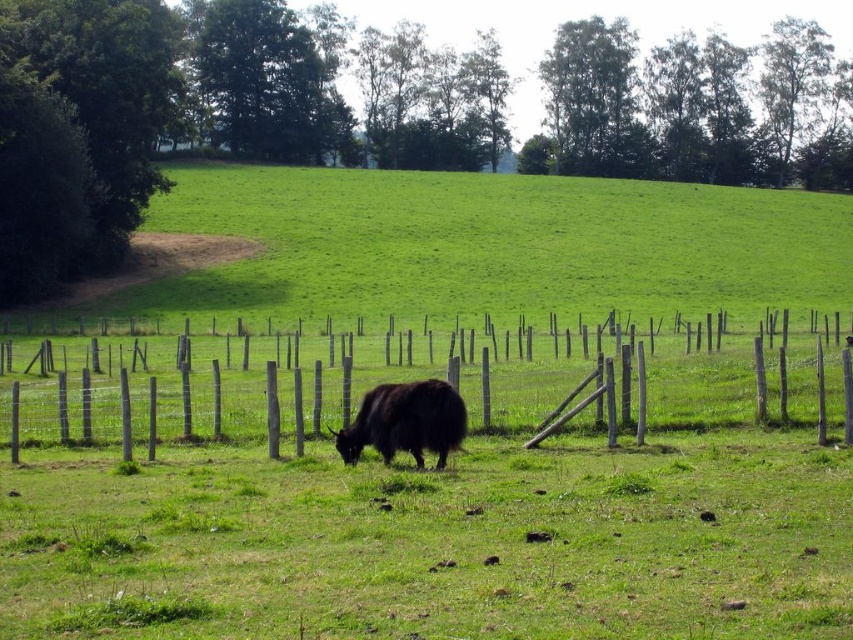
I want to click on wooden post fence at center, so click(x=448, y=381).

What do you see at coordinates (448, 381) in the screenshot? I see `wooden post fence at center` at bounding box center [448, 381].

Describe the element at coordinates (448, 381) in the screenshot. I see `wooden post fence at center` at that location.

This screenshot has height=640, width=853. Identify the location of wooden post fence at center. (448, 381).